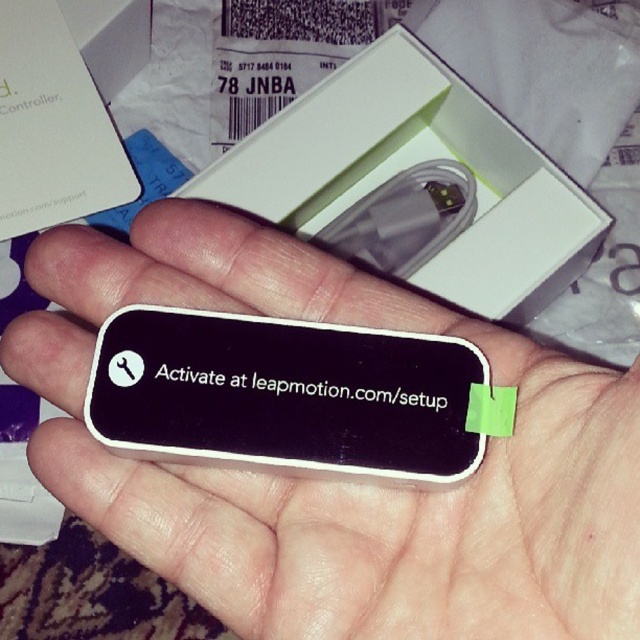
Question: Where is black matte card at center located in relation to white matte box at center in the image?

Choices:
 (A) below
 (B) above

Answer: (A)

Question: Which of the following is the closest to the observer?

Choices:
 (A) black matte card at center
 (B) white matte box at center
 (C) black matte text at center

Answer: (A)

Question: Which object is the closest to the white matte box at center?

Choices:
 (A) black matte text at center
 (B) black matte card at center

Answer: (B)

Question: Which of the following is the closest to the observer?

Choices:
 (A) (289, 214)
 (B) (378, 364)

Answer: (B)

Question: Does black matte card at center have a lesser width compared to black matte text at center?

Choices:
 (A) yes
 (B) no

Answer: (B)

Question: Can you confirm if black matte card at center is smaller than white matte box at center?

Choices:
 (A) no
 (B) yes

Answer: (A)